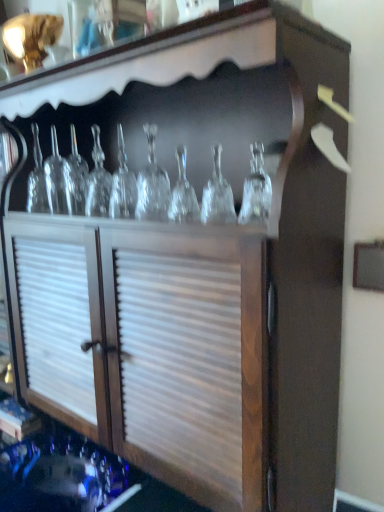
What do you see at coordinates (152, 184) in the screenshot?
I see `transparent glass wine glass at center, which is the second glass bottle from left to right` at bounding box center [152, 184].

I want to click on transparent glass wine glass at center, which is the 1th glass bottle in right-to-left order, so click(152, 184).

This screenshot has height=512, width=384. Describe the element at coordinates (61, 181) in the screenshot. I see `clear glass bottle at left, acting as the first glass bottle starting from the back` at that location.

Identify the location of clear glass bottle at left, which is the 2th glass bottle from front to back. Image resolution: width=384 pixels, height=512 pixels. (61, 181).

Locate an element on the screen. Image resolution: width=384 pixels, height=512 pixels. transparent glass wine glass at center, which is the second glass bottle from back to front is located at coordinates (152, 184).

Visually, is clear glass bottle at left, acting as the first glass bottle starting from the back, positioned to the left or to the right of transparent glass wine glass at center, which is the second glass bottle from left to right?

clear glass bottle at left, acting as the first glass bottle starting from the back, is to the left of transparent glass wine glass at center, which is the second glass bottle from left to right.

Between clear glass bottle at left, the first glass bottle in the left-to-right sequence, and transparent glass wine glass at center, which is the second glass bottle from left to right, which one is positioned behind?

clear glass bottle at left, the first glass bottle in the left-to-right sequence, is further from the camera.

Which is closer to the camera, (48, 195) or (153, 154)?

Point (48, 195) is farther from the camera than point (153, 154).

From the image's perspective, is clear glass bottle at left, the first glass bottle in the left-to-right sequence, beneath transparent glass wine glass at center, which is the 1th glass bottle in right-to-left order?

No.

Consider the image. From a real-world perspective, which object stands above the other?

clear glass bottle at left, which is the 2th glass bottle from front to back.

Between clear glass bottle at left, the first glass bottle in the left-to-right sequence, and transparent glass wine glass at center, acting as the first glass bottle starting from the front, which one has larger width?

Wider between the two is clear glass bottle at left, the first glass bottle in the left-to-right sequence.

Does clear glass bottle at left, the first glass bottle in the left-to-right sequence, have a greater height compared to transparent glass wine glass at center, acting as the first glass bottle starting from the front?

Incorrect, the height of clear glass bottle at left, the first glass bottle in the left-to-right sequence, is not larger of that of transparent glass wine glass at center, acting as the first glass bottle starting from the front.

Can you confirm if clear glass bottle at left, marked as the second glass bottle in a right-to-left arrangement, is smaller than transparent glass wine glass at center, which is the second glass bottle from left to right?

Yes, clear glass bottle at left, marked as the second glass bottle in a right-to-left arrangement, is smaller than transparent glass wine glass at center, which is the second glass bottle from left to right.

Which is correct: clear glass bottle at left, marked as the second glass bottle in a right-to-left arrangement, is inside transparent glass wine glass at center, which is the second glass bottle from left to right, or outside of it?

clear glass bottle at left, marked as the second glass bottle in a right-to-left arrangement, is located beyond the bounds of transparent glass wine glass at center, which is the second glass bottle from left to right.

Are clear glass bottle at left, which is the 2th glass bottle from front to back, and transparent glass wine glass at center, which is the second glass bottle from back to front, beside each other?

No, clear glass bottle at left, which is the 2th glass bottle from front to back, is not touching transparent glass wine glass at center, which is the second glass bottle from back to front.

Is clear glass bottle at left, the first glass bottle in the left-to-right sequence, turned away from transparent glass wine glass at center, which is the 1th glass bottle in right-to-left order?

No, clear glass bottle at left, the first glass bottle in the left-to-right sequence, is not facing the opposite direction of transparent glass wine glass at center, which is the 1th glass bottle in right-to-left order.

How far apart are clear glass bottle at left, which is the 2th glass bottle from front to back, and transparent glass wine glass at center, which is the second glass bottle from left to right?

clear glass bottle at left, which is the 2th glass bottle from front to back, is 26.12 centimeters from transparent glass wine glass at center, which is the second glass bottle from left to right.

The height and width of the screenshot is (512, 384). I want to click on glass bottle below the clear glass bottle at left, marked as the second glass bottle in a right-to-left arrangement (from the image's perspective), so click(152, 184).

Considering the relative positions of transparent glass wine glass at center, acting as the first glass bottle starting from the front, and clear glass bottle at left, marked as the second glass bottle in a right-to-left arrangement, in the image provided, is transparent glass wine glass at center, acting as the first glass bottle starting from the front, to the left or to the right of clear glass bottle at left, marked as the second glass bottle in a right-to-left arrangement,?

transparent glass wine glass at center, acting as the first glass bottle starting from the front, is to the right of clear glass bottle at left, marked as the second glass bottle in a right-to-left arrangement.

Who is more distant, transparent glass wine glass at center, which is the second glass bottle from back to front, or clear glass bottle at left, marked as the second glass bottle in a right-to-left arrangement?

clear glass bottle at left, marked as the second glass bottle in a right-to-left arrangement, is further away from the camera.

Does point (153, 148) come farther from viewer compared to point (44, 163)?

No, (153, 148) is closer to viewer.

From the image's perspective, is transparent glass wine glass at center, acting as the first glass bottle starting from the front, above or below clear glass bottle at left, acting as the first glass bottle starting from the back?

transparent glass wine glass at center, acting as the first glass bottle starting from the front, is situated lower than clear glass bottle at left, acting as the first glass bottle starting from the back, in the image.

From a real-world perspective, is transparent glass wine glass at center, acting as the first glass bottle starting from the front, located beneath clear glass bottle at left, marked as the second glass bottle in a right-to-left arrangement?

Yes, from a real-world perspective, transparent glass wine glass at center, acting as the first glass bottle starting from the front, is beneath clear glass bottle at left, marked as the second glass bottle in a right-to-left arrangement.

Considering the sizes of objects transparent glass wine glass at center, which is the 1th glass bottle in right-to-left order, and clear glass bottle at left, marked as the second glass bottle in a right-to-left arrangement, in the image provided, who is wider, transparent glass wine glass at center, which is the 1th glass bottle in right-to-left order, or clear glass bottle at left, marked as the second glass bottle in a right-to-left arrangement,?

clear glass bottle at left, marked as the second glass bottle in a right-to-left arrangement.

Between transparent glass wine glass at center, which is the 1th glass bottle in right-to-left order, and clear glass bottle at left, acting as the first glass bottle starting from the back, which one has more height?

transparent glass wine glass at center, which is the 1th glass bottle in right-to-left order, is taller.

Based on the photo, does transparent glass wine glass at center, acting as the first glass bottle starting from the front, have a larger size compared to clear glass bottle at left, the first glass bottle in the left-to-right sequence?

Correct, transparent glass wine glass at center, acting as the first glass bottle starting from the front, is larger in size than clear glass bottle at left, the first glass bottle in the left-to-right sequence.

Would you say transparent glass wine glass at center, which is the second glass bottle from back to front, is outside clear glass bottle at left, acting as the first glass bottle starting from the back?

Indeed, transparent glass wine glass at center, which is the second glass bottle from back to front, is completely outside clear glass bottle at left, acting as the first glass bottle starting from the back.

Is transparent glass wine glass at center, which is the second glass bottle from back to front, next to clear glass bottle at left, which is the 2th glass bottle from front to back, and touching it?

There is a gap between transparent glass wine glass at center, which is the second glass bottle from back to front, and clear glass bottle at left, which is the 2th glass bottle from front to back.

Could you tell me if transparent glass wine glass at center, acting as the first glass bottle starting from the front, is facing clear glass bottle at left, marked as the second glass bottle in a right-to-left arrangement?

No, transparent glass wine glass at center, acting as the first glass bottle starting from the front, is not turned towards clear glass bottle at left, marked as the second glass bottle in a right-to-left arrangement.

What's the angular difference between transparent glass wine glass at center, which is the second glass bottle from left to right, and clear glass bottle at left, which is the 2th glass bottle from front to back,'s facing directions?

0.000249 degrees.

Where is `glass bottle below the clear glass bottle at left, the first glass bottle in the left-to-right sequence (from a real-world perspective)`? This screenshot has width=384, height=512. glass bottle below the clear glass bottle at left, the first glass bottle in the left-to-right sequence (from a real-world perspective) is located at coordinates (152, 184).

The image size is (384, 512). Identify the location of glass bottle lying above the transparent glass wine glass at center, which is the second glass bottle from left to right (from the image's perspective). (61, 181).

I want to click on glass bottle in front of the clear glass bottle at left, acting as the first glass bottle starting from the back, so 152,184.